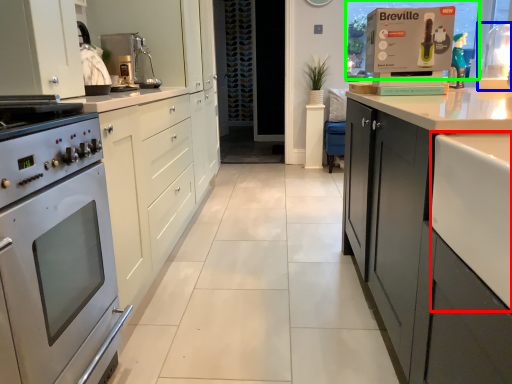
Question: Considering the real-world distances, which object is closest to counter top (highlighted by a red box)? appliance (highlighted by a blue box) or window screen (highlighted by a green box).

Choices:
 (A) appliance
 (B) window screen

Answer: (B)